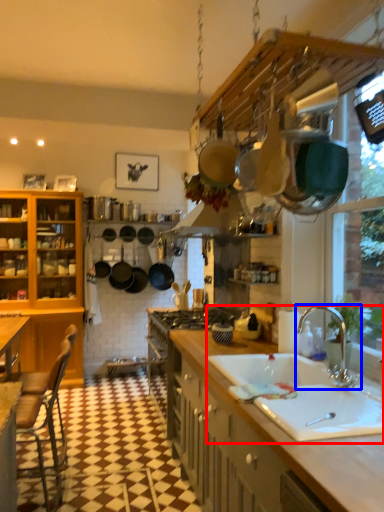
Question: Which point is closer to the camera, sink (highlighted by a red box) or tap (highlighted by a blue box)?

Choices:
 (A) sink
 (B) tap

Answer: (A)